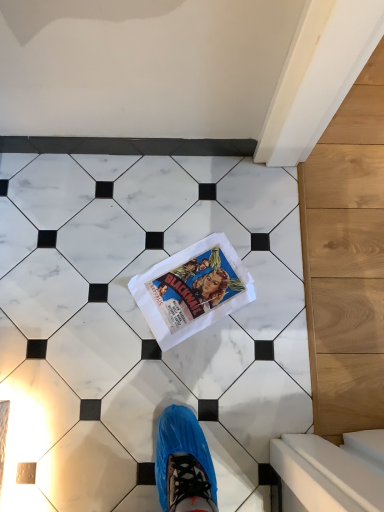
Locate an element on the screen. free space above white paper comic book at center (from a real-world perspective) is located at coordinates (197, 285).